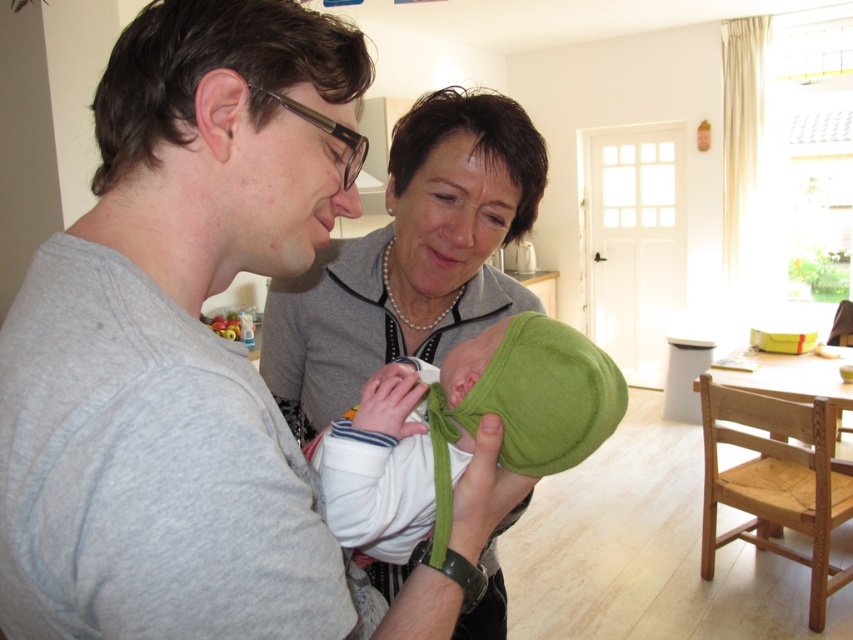
You are a photographer setting up for a family photo. You notice the pearl necklace at upper center and the green fleece hat at center. Where should you position your camera to ensure both items are in frame without moving them?

Position the camera so it faces the center area where both the pearl necklace at upper center and the green fleece hat at center are visible. Since the pearl necklace at upper center is to the left of the green fleece hat at center, centering the camera between them will keep both items in frame.

You are a photographer standing 20 inches away from the camera. You want to take a photo of the gray cotton shirt at center. Can you reach it without moving your position?

The gray cotton shirt at center is 15.94 inches away from the camera, so yes, you can reach it without moving your position since you are only 20 inches away, which is farther than the shirt.

You are a photographer setting up a shoot in this scene. You need to ensure that the gray cotton shirt at center and the green fleece hat at center are both visible in the final photo. Based on their positions, which object should you focus on first to ensure both are in frame?

The gray cotton shirt at center is in front of the green fleece hat at center. To ensure both are visible, focus on the gray cotton shirt at center first, as it is closer to the camera, and adjust the framing to include the green fleece hat at center behind it.